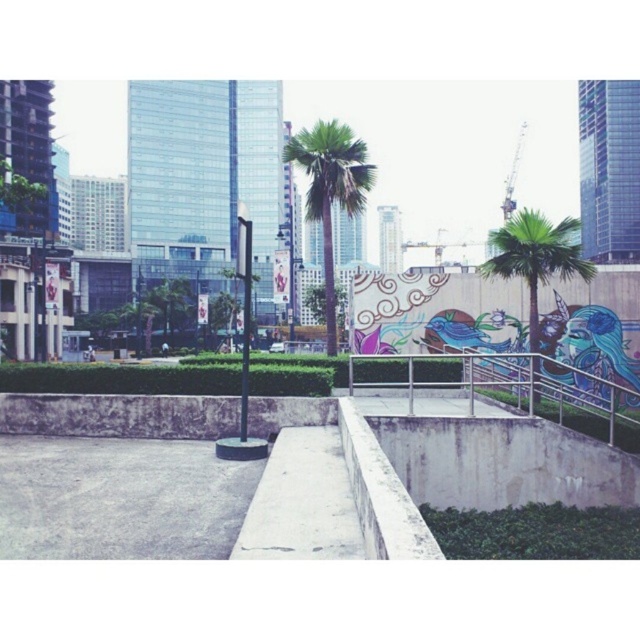
Question: Considering the relative positions of metallic silver railing at center and green leafy palm at center in the image provided, where is metallic silver railing at center located with respect to green leafy palm at center?

Choices:
 (A) above
 (B) below

Answer: (B)

Question: Does green leafy palm at center appear over green leafy palm tree at right?

Choices:
 (A) no
 (B) yes

Answer: (B)

Question: Which point appears closest to the camera in this image?

Choices:
 (A) (408, 396)
 (B) (502, 252)

Answer: (A)

Question: Among these points, which one is farthest from the camera?

Choices:
 (A) (508, 401)
 (B) (324, 221)

Answer: (B)

Question: Is metallic silver railing at center thinner than green leafy palm at center?

Choices:
 (A) yes
 (B) no

Answer: (B)

Question: Which object appears farthest from the camera in this image?

Choices:
 (A) green leafy palm at center
 (B) metallic silver railing at center
 (C) green leafy palm tree at right

Answer: (A)